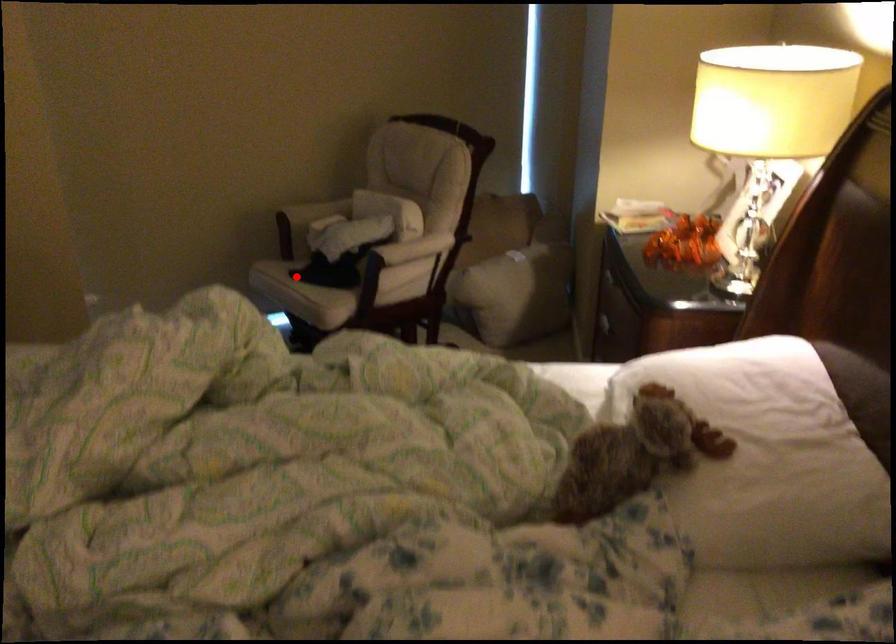
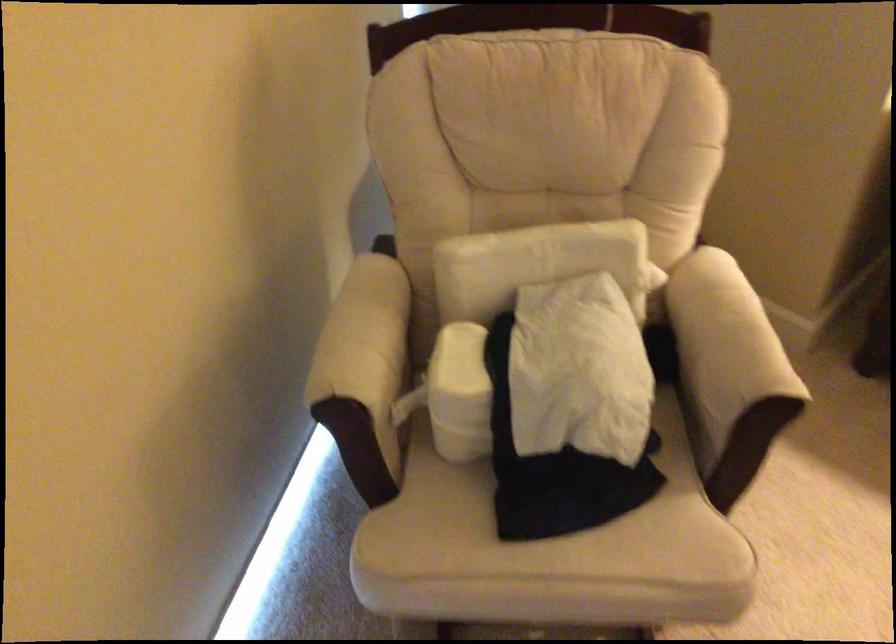
Find the pixel in the second image that matches the highlighted location in the first image.

(545, 535)